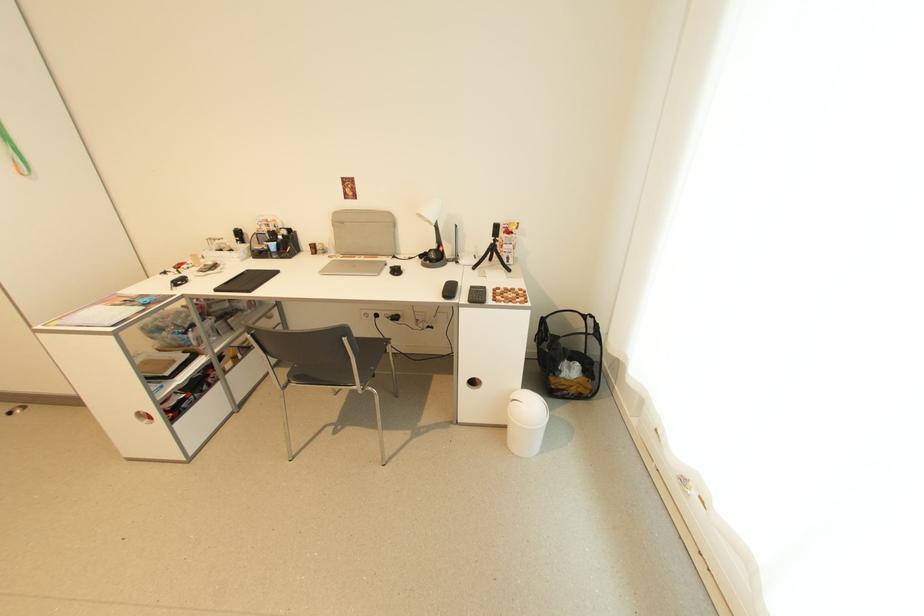
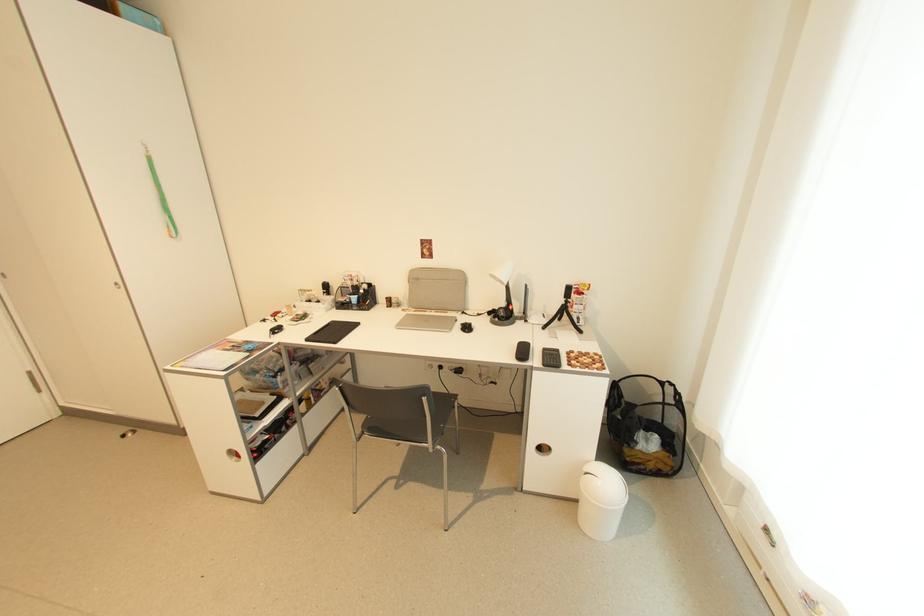
Question: What movement of the cameraman would produce the second image?

Choices:
 (A) Left
 (B) Right
 (C) Forward
 (D) Backward

Answer: (A)